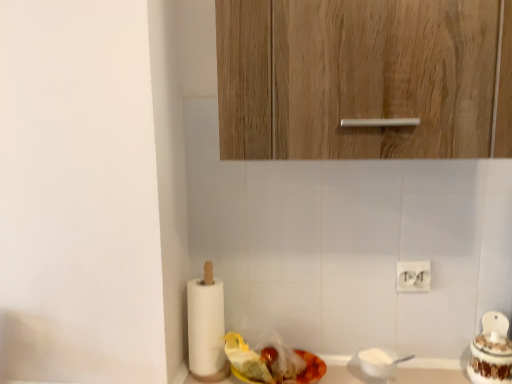
What is the approximate width of wooden cabinet at upper center?

13.35 inches.

Image resolution: width=512 pixels, height=384 pixels. What are the coordinates of `white paper at left` in the screenshot? It's located at (205, 326).

How different are the orientations of white plastic electric outlet at lower right and wooden cabinet at upper center in degrees?

The facing directions of white plastic electric outlet at lower right and wooden cabinet at upper center are 1.02 degrees apart.

Is white plastic electric outlet at lower right wider or thinner than wooden cabinet at upper center?

In the image, white plastic electric outlet at lower right appears to be more narrow than wooden cabinet at upper center.

Looking at this image, considering their positions, is white plastic electric outlet at lower right located in front of or behind wooden cabinet at upper center?

white plastic electric outlet at lower right is positioned farther from the viewer than wooden cabinet at upper center.

From the image's perspective, between white plastic electric outlet at lower right and wooden cabinet at upper center, who is located below?

From the image's view, white plastic electric outlet at lower right is below.

Consider the image. Would you say white plastic electric outlet at lower right is inside or outside white paper at left?

white plastic electric outlet at lower right is not inside white paper at left, it's outside.

Can you confirm if white plastic electric outlet at lower right is wider than white paper at left?

In fact, white plastic electric outlet at lower right might be narrower than white paper at left.

Considering the relative sizes of white plastic electric outlet at lower right and white paper at left in the image provided, is white plastic electric outlet at lower right shorter than white paper at left?

Yes, white plastic electric outlet at lower right is shorter than white paper at left.

From the image's perspective, is white glossy cake at right, the second food when ordered from left to right, above white paper at left?

No.

Considering the sizes of objects white glossy cake at right, placed as the 1th food when sorted from right to left, and white paper at left in the image provided, who is bigger, white glossy cake at right, placed as the 1th food when sorted from right to left, or white paper at left?

white paper at left.

Would you consider white glossy cake at right, the second food when ordered from left to right, to be distant from white paper at left?

No, there isn't a large distance between white glossy cake at right, the second food when ordered from left to right, and white paper at left.

From a real-world perspective, is white glossy cake at right, placed as the 1th food when sorted from right to left, positioned above or below white paper at left?

From a real-world perspective, white glossy cake at right, placed as the 1th food when sorted from right to left, is physically below white paper at left.

Considering the relative sizes of wooden cabinet at upper center and white glossy cake at right, the second food when ordered from left to right, in the image provided, is wooden cabinet at upper center taller than white glossy cake at right, the second food when ordered from left to right,?

Indeed, wooden cabinet at upper center has a greater height compared to white glossy cake at right, the second food when ordered from left to right.

Who is more distant, wooden cabinet at upper center or white glossy cake at right, placed as the 1th food when sorted from right to left?

white glossy cake at right, placed as the 1th food when sorted from right to left, is further away from the camera.

Looking at this image, can you confirm if wooden cabinet at upper center is wider than white glossy cake at right, placed as the 1th food when sorted from right to left?

Correct, the width of wooden cabinet at upper center exceeds that of white glossy cake at right, placed as the 1th food when sorted from right to left.

Considering the positions of objects wooden cabinet at upper center and white glossy cake at right, placed as the 1th food when sorted from right to left, in the image provided, who is more to the right, wooden cabinet at upper center or white glossy cake at right, placed as the 1th food when sorted from right to left,?

From the viewer's perspective, white glossy cake at right, placed as the 1th food when sorted from right to left, appears more on the right side.

The image size is (512, 384). What are the coordinates of `food below the white glossy cake at right, placed as the 1th food when sorted from right to left (from the image's perspective)` in the screenshot? It's located at (272, 362).

Measure the distance between white glossy cake at right, placed as the 1th food when sorted from right to left, and shiny plastic container at lower center, placed as the second food when sorted from right to left.

white glossy cake at right, placed as the 1th food when sorted from right to left, is 18.43 inches away from shiny plastic container at lower center, placed as the second food when sorted from right to left.

Can you confirm if white glossy cake at right, the second food when ordered from left to right, is taller than shiny plastic container at lower center, which is the first food in left-to-right order?

Correct, white glossy cake at right, the second food when ordered from left to right, is much taller as shiny plastic container at lower center, which is the first food in left-to-right order.

From a real-world perspective, is white glossy cake at right, the second food when ordered from left to right, located beneath shiny plastic container at lower center, which is the first food in left-to-right order?

No, from a real-world perspective, white glossy cake at right, the second food when ordered from left to right, is not under shiny plastic container at lower center, which is the first food in left-to-right order.

How different are the orientations of shiny plastic container at lower center, which is the first food in left-to-right order, and white plastic electric outlet at lower right in degrees?

shiny plastic container at lower center, which is the first food in left-to-right order, and white plastic electric outlet at lower right are facing 0.684 degrees away from each other.

Which is less distant, (312, 377) or (425, 264)?

Point (312, 377).

Are shiny plastic container at lower center, placed as the second food when sorted from right to left, and white plastic electric outlet at lower right making contact?

No, shiny plastic container at lower center, placed as the second food when sorted from right to left, is not making contact with white plastic electric outlet at lower right.

Does shiny plastic container at lower center, placed as the second food when sorted from right to left, turn towards white plastic electric outlet at lower right?

No.

Is white plastic electric outlet at lower right further to camera compared to shiny plastic container at lower center, placed as the second food when sorted from right to left?

Yes.

Are white plastic electric outlet at lower right and shiny plastic container at lower center, placed as the second food when sorted from right to left, far apart?

white plastic electric outlet at lower right is actually quite close to shiny plastic container at lower center, placed as the second food when sorted from right to left.

In the scene shown: From the image's perspective, between white plastic electric outlet at lower right and shiny plastic container at lower center, placed as the second food when sorted from right to left, who is located below?

shiny plastic container at lower center, placed as the second food when sorted from right to left, from the image's perspective.

Image resolution: width=512 pixels, height=384 pixels. Identify the location of cabinetry on the left of white plastic electric outlet at lower right. (364, 78).

Image resolution: width=512 pixels, height=384 pixels. In order to click on paper towel below the white plastic electric outlet at lower right (from a real-world perspective) in this screenshot , I will do `click(205, 326)`.

Which object lies nearer to the anchor point white glossy cake at right, the second food when ordered from left to right, shiny plastic container at lower center, placed as the second food when sorted from right to left, or white paper at left?

Among the two, shiny plastic container at lower center, placed as the second food when sorted from right to left, is located nearer to white glossy cake at right, the second food when ordered from left to right.

Estimate the real-world distances between objects in this image. Which object is closer to white plastic electric outlet at lower right, white paper at left or shiny plastic container at lower center, placed as the second food when sorted from right to left?

The object closer to white plastic electric outlet at lower right is shiny plastic container at lower center, placed as the second food when sorted from right to left.

When comparing their distances from white paper at left, does white glossy cake at right, placed as the 1th food when sorted from right to left, or white plastic electric outlet at lower right seem further?

white glossy cake at right, placed as the 1th food when sorted from right to left, lies further to white paper at left than the other object.

Considering their positions, is shiny plastic container at lower center, placed as the second food when sorted from right to left, positioned closer to white paper at left than white plastic electric outlet at lower right?

shiny plastic container at lower center, placed as the second food when sorted from right to left, lies closer to white paper at left than the other object.

Which object lies further to the anchor point wooden cabinet at upper center, shiny plastic container at lower center, which is the first food in left-to-right order, or white glossy cake at right, placed as the 1th food when sorted from right to left?

Among the two, white glossy cake at right, placed as the 1th food when sorted from right to left, is located further to wooden cabinet at upper center.

In the scene shown: When comparing their distances from white glossy cake at right, placed as the 1th food when sorted from right to left, does white plastic electric outlet at lower right or white paper at left seem further?

white paper at left.

Considering their positions, is white glossy cake at right, the second food when ordered from left to right, positioned further to wooden cabinet at upper center than white plastic electric outlet at lower right?

Based on the image, white glossy cake at right, the second food when ordered from left to right, appears to be further to wooden cabinet at upper center.

When comparing their distances from wooden cabinet at upper center, does white glossy cake at right, the second food when ordered from left to right, or shiny plastic container at lower center, placed as the second food when sorted from right to left, seem further?

Based on the image, white glossy cake at right, the second food when ordered from left to right, appears to be further to wooden cabinet at upper center.

Where is `electric outlet between wooden cabinet at upper center and white paper at left from top to bottom`? electric outlet between wooden cabinet at upper center and white paper at left from top to bottom is located at coordinates (413, 276).

At what (x,y) coordinates should I click in order to perform the action: click on paper towel between wooden cabinet at upper center and white glossy cake at right, the second food when ordered from left to right, vertically. Please return your answer as a coordinate pair (x, y). Looking at the image, I should click on click(x=205, y=326).

Where is `electric outlet between wooden cabinet at upper center and shiny plastic container at lower center, which is the first food in left-to-right order, in the vertical direction`? The width and height of the screenshot is (512, 384). electric outlet between wooden cabinet at upper center and shiny plastic container at lower center, which is the first food in left-to-right order, in the vertical direction is located at coordinates (413, 276).

Locate an element on the screen. The image size is (512, 384). electric outlet between white paper at left and white glossy cake at right, placed as the 1th food when sorted from right to left, from left to right is located at coordinates (413, 276).